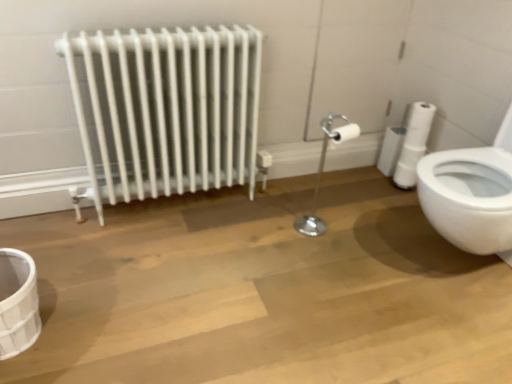
Question: Considering the relative positions of white matte toilet paper at right and white metallic radiator at left in the image provided, is white matte toilet paper at right to the left of white metallic radiator at left from the viewer's perspective?

Choices:
 (A) yes
 (B) no

Answer: (B)

Question: Can you confirm if white matte toilet paper at right is taller than white metallic radiator at left?

Choices:
 (A) no
 (B) yes

Answer: (A)

Question: Considering the relative sizes of white matte toilet paper at right and white metallic radiator at left in the image provided, is white matte toilet paper at right bigger than white metallic radiator at left?

Choices:
 (A) no
 (B) yes

Answer: (A)

Question: Is white matte toilet paper at right beside white metallic radiator at left?

Choices:
 (A) yes
 (B) no

Answer: (B)

Question: Does white matte toilet paper at right have a lesser width compared to white metallic radiator at left?

Choices:
 (A) yes
 (B) no

Answer: (A)

Question: Is the position of white matte toilet paper at right more distant than that of white metallic radiator at left?

Choices:
 (A) yes
 (B) no

Answer: (A)

Question: From a real-world perspective, is white metallic radiator at left physically above white matte toilet paper at right?

Choices:
 (A) yes
 (B) no

Answer: (A)

Question: Considering the relative sizes of white metallic radiator at left and white matte toilet paper at right in the image provided, is white metallic radiator at left shorter than white matte toilet paper at right?

Choices:
 (A) yes
 (B) no

Answer: (B)

Question: Is white metallic radiator at left far from white matte toilet paper at right?

Choices:
 (A) no
 (B) yes

Answer: (B)

Question: Is white metallic radiator at left oriented away from white matte toilet paper at right?

Choices:
 (A) yes
 (B) no

Answer: (B)

Question: Would you say white metallic radiator at left is outside white matte toilet paper at right?

Choices:
 (A) yes
 (B) no

Answer: (A)

Question: Would you say white matte toilet paper at right is part of white metallic radiator at left's contents?

Choices:
 (A) no
 (B) yes

Answer: (A)

Question: From the image's perspective, relative to white metallic radiator at left, is white matte toilet paper at right above or below?

Choices:
 (A) above
 (B) below

Answer: (A)